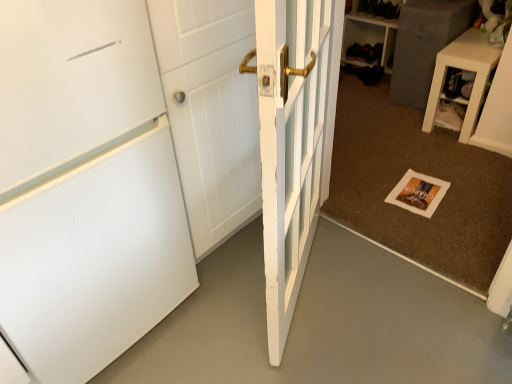
What is the approximate width of matte gray cabinet at upper right?

12.67 inches.

This screenshot has height=384, width=512. What do you see at coordinates (293, 140) in the screenshot?
I see `white painted wood door at center, placed as the 2th door when sorted from left to right` at bounding box center [293, 140].

Looking at this image, measure the distance between point (332, 16) and camera.

A distance of 4.48 feet exists between point (332, 16) and camera.

The height and width of the screenshot is (384, 512). Find the location of `matte gray cabinet at upper right`. matte gray cabinet at upper right is located at coordinates (425, 45).

From the image's perspective, is black leather shoe at upper center below brown textured mat at center?

No, from the image's perspective, black leather shoe at upper center is not below brown textured mat at center.

Is black leather shoe at upper center aimed at brown textured mat at center?

No, black leather shoe at upper center is not oriented towards brown textured mat at center.

Is black leather shoe at upper center beside brown textured mat at center?

No.

Which is in front, black leather shoe at upper center or brown textured mat at center?

brown textured mat at center is in front.

Considering the relative sizes of black leather shoe at upper center and white matte door at left, marked as the first door in a left-to-right arrangement, in the image provided, is black leather shoe at upper center smaller than white matte door at left, marked as the first door in a left-to-right arrangement,?

Yes, black leather shoe at upper center is smaller than white matte door at left, marked as the first door in a left-to-right arrangement.

In the scene shown: From a real-world perspective, who is located higher, black leather shoe at upper center or white matte door at left, marked as the first door in a left-to-right arrangement?

white matte door at left, marked as the first door in a left-to-right arrangement, from a real-world perspective.

From the image's perspective, does black leather shoe at upper center appear higher than white matte door at left, marked as the first door in a left-to-right arrangement?

Correct, black leather shoe at upper center appears higher than white matte door at left, marked as the first door in a left-to-right arrangement, in the image.

Could you tell me if black leather shoe at upper center is facing matte gray cabinet at upper right?

No, black leather shoe at upper center is not oriented towards matte gray cabinet at upper right.

Visually, is black leather shoe at upper center positioned to the left or to the right of matte gray cabinet at upper right?

From the image, it's evident that black leather shoe at upper center is to the left of matte gray cabinet at upper right.

Is point (362, 49) positioned before point (472, 6)?

No.

Is there a large distance between black leather shoe at upper center and matte gray cabinet at upper right?

No.

Is brown textured mat at center wider or thinner than white painted wood door at center, which is the first door in right-to-left order?

brown textured mat at center is wider than white painted wood door at center, which is the first door in right-to-left order.

Which is less distant, (373,228) or (272,112)?

Point (373,228) appears to be farther away from the viewer than point (272,112).

From the image's perspective, between brown textured mat at center and white painted wood door at center, placed as the 2th door when sorted from left to right, which one is located above?

brown textured mat at center is shown above in the image.

Consider the image. Which of these two, brown textured mat at center or white painted wood door at center, which is the first door in right-to-left order, stands shorter?

With less height is brown textured mat at center.

Is matte gray cabinet at upper right taller than white matte door at left, which is the 2th door from right to left?

Incorrect, the height of matte gray cabinet at upper right is not larger of that of white matte door at left, which is the 2th door from right to left.

Considering the relative sizes of matte gray cabinet at upper right and white matte door at left, marked as the first door in a left-to-right arrangement, in the image provided, is matte gray cabinet at upper right thinner than white matte door at left, marked as the first door in a left-to-right arrangement,?

Correct, the width of matte gray cabinet at upper right is less than that of white matte door at left, marked as the first door in a left-to-right arrangement.

Identify the location of cabinetry beneath the white matte door at left, marked as the first door in a left-to-right arrangement (from a real-world perspective). This screenshot has width=512, height=384. (425, 45).

Is point (447, 11) positioned behind point (172, 155)?

Yes, point (447, 11) is behind point (172, 155).

Is brown textured mat at center taller than white matte door at left, which is the 2th door from right to left?

Incorrect, the height of brown textured mat at center is not larger of that of white matte door at left, which is the 2th door from right to left.

How different are the orientations of brown textured mat at center and white matte door at left, which is the 2th door from right to left, in degrees?

The angle between the facing direction of brown textured mat at center and the facing direction of white matte door at left, which is the 2th door from right to left, is 90.6 degrees.

Does point (414, 137) appear closer or farther from the camera than point (76, 27)?

Point (414, 137) is farther from the camera than point (76, 27).

From the image's perspective, starting from the brown textured mat at center, which door is the 2nd one below? Please provide its 2D coordinates.

[(85, 187)]

Which of these two, matte gray cabinet at upper right or black leather shoe at upper center, is bigger?

matte gray cabinet at upper right.

Which is correct: matte gray cabinet at upper right is inside black leather shoe at upper center, or outside of it?

The correct answer is: outside.

Which is more to the left, matte gray cabinet at upper right or black leather shoe at upper center?

From the viewer's perspective, black leather shoe at upper center appears more on the left side.

From the image's perspective, does matte gray cabinet at upper right appear lower than black leather shoe at upper center?

Yes, from the image's perspective, matte gray cabinet at upper right is beneath black leather shoe at upper center.

Find the location of a particular element. This screenshot has height=384, width=512. shoe on the right of brown textured mat at center is located at coordinates (365, 52).

In the image, there is a white matte door at left, marked as the first door in a left-to-right arrangement. Identify the location of shoe above it (from the image's perspective). Image resolution: width=512 pixels, height=384 pixels. (365, 52).

Based on their spatial positions, is white glossy side table at upper right or brown textured mat at center closer to matte gray cabinet at upper right?

Among the two, white glossy side table at upper right is located nearer to matte gray cabinet at upper right.

Estimate the real-world distances between objects in this image. Which object is further from black leather shoe at upper center, brown textured mat at center or white matte door at left, which is the 2th door from right to left?

white matte door at left, which is the 2th door from right to left, is positioned further to the anchor black leather shoe at upper center.

Looking at the image, which one is located closer to black leather shoe at upper center, matte gray cabinet at upper right or white matte door at left, which is the 2th door from right to left?

Among the two, matte gray cabinet at upper right is located nearer to black leather shoe at upper center.

When comparing their distances from white matte door at left, which is the 2th door from right to left, does matte gray cabinet at upper right or black leather shoe at upper center seem further?

The object further to white matte door at left, which is the 2th door from right to left, is black leather shoe at upper center.

Looking at this image, which object lies further to the anchor point black leather shoe at upper center, white glossy side table at upper right or white matte door at left, marked as the first door in a left-to-right arrangement?

white matte door at left, marked as the first door in a left-to-right arrangement, is positioned further to the anchor black leather shoe at upper center.

Considering their positions, is matte gray cabinet at upper right positioned further to black leather shoe at upper center than white glossy side table at upper right?

white glossy side table at upper right is further to black leather shoe at upper center.

Considering their positions, is brown textured mat at center positioned closer to white glossy side table at upper right than white painted wood door at center, which is the first door in right-to-left order?

Based on the image, brown textured mat at center appears to be nearer to white glossy side table at upper right.

Looking at this image, which object lies further to the anchor point matte gray cabinet at upper right, black leather shoe at upper center or brown textured mat at center?

black leather shoe at upper center is positioned further to the anchor matte gray cabinet at upper right.

At what (x,y) coordinates should I click in order to perform the action: click on furniture between brown textured mat at center and black leather shoe at upper center along the z-axis. Please return your answer as a coordinate pair (x, y). Looking at the image, I should click on (463, 69).

The image size is (512, 384). In order to click on concrete positioned between white matte door at left, which is the 2th door from right to left, and black leather shoe at upper center from near to far in this screenshot , I will do `click(322, 323)`.

Where is `cabinetry located between white glossy side table at upper right and black leather shoe at upper center in the depth direction`? The width and height of the screenshot is (512, 384). cabinetry located between white glossy side table at upper right and black leather shoe at upper center in the depth direction is located at coordinates (425, 45).

Locate an element on the screen. This screenshot has width=512, height=384. door positioned between white matte door at left, which is the 2th door from right to left, and matte gray cabinet at upper right from near to far is located at coordinates (293, 140).